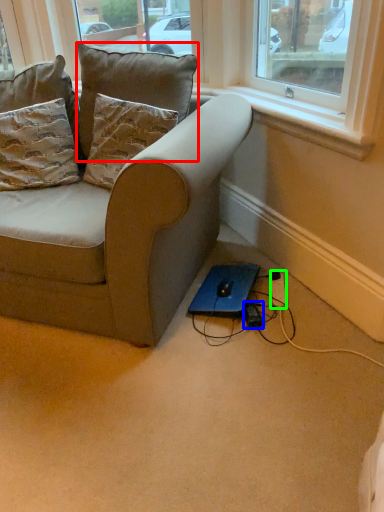
Question: Considering the real-world distances, which object is farthest from pillow (highlighted by a red box)? plug (highlighted by a blue box) or extension cord (highlighted by a green box)?

Choices:
 (A) plug
 (B) extension cord

Answer: (A)